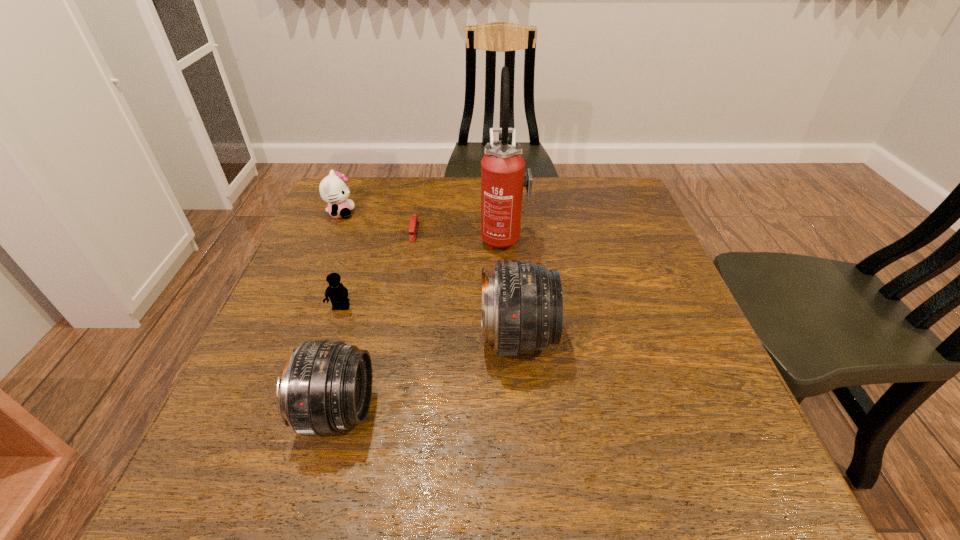
Locate an element on the screen. This screenshot has width=960, height=540. the left telephoto lens is located at coordinates (326, 386).

You are a GUI agent. You are given a task and a screenshot of the screen. Output one action in this format:
    pyautogui.click(x=<x>, y=<y>)
    Task: Click on the fourth shortest object
    Image resolution: width=960 pixels, height=540 pixels.
    Given the screenshot: What is the action you would take?
    pyautogui.click(x=326, y=386)

Where is `the taller telephoto lens`? the taller telephoto lens is located at coordinates (522, 303).

Where is `the fifth shortest object`? the fifth shortest object is located at coordinates (522, 303).

This screenshot has width=960, height=540. In order to click on fire extinguisher in this screenshot , I will do `click(503, 177)`.

You are a GUI agent. You are given a task and a screenshot of the screen. Output one action in this format:
    pyautogui.click(x=<x>, y=<y>)
    Task: Click on the fourth tallest object
    This screenshot has height=540, width=960.
    Given the screenshot: What is the action you would take?
    pyautogui.click(x=333, y=189)

What are the coordinates of `kitten` in the screenshot? It's located at click(333, 189).

You are a GUI agent. You are given a task and a screenshot of the screen. Output one action in this format:
    pyautogui.click(x=<x>, y=<y>)
    Task: Click on the shortest object
    
    Given the screenshot: What is the action you would take?
    pyautogui.click(x=413, y=227)

Locate an element on the screen. The width and height of the screenshot is (960, 540). stapler is located at coordinates (413, 227).

You are a GUI agent. You are given a task and a screenshot of the screen. Output one action in this format:
    pyautogui.click(x=<x>, y=<y>)
    Task: Click on the fifth tallest object
    The image size is (960, 540).
    Given the screenshot: What is the action you would take?
    pyautogui.click(x=338, y=294)